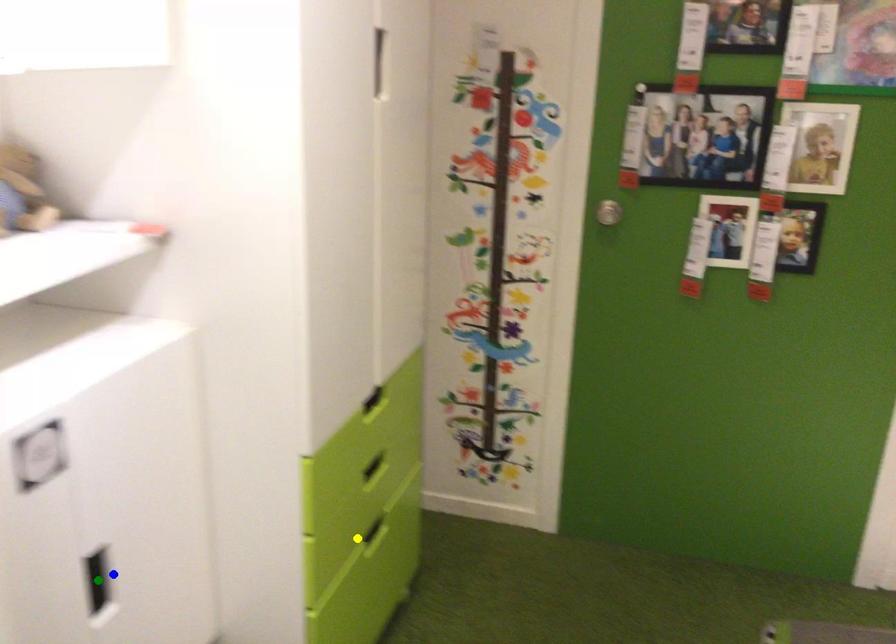
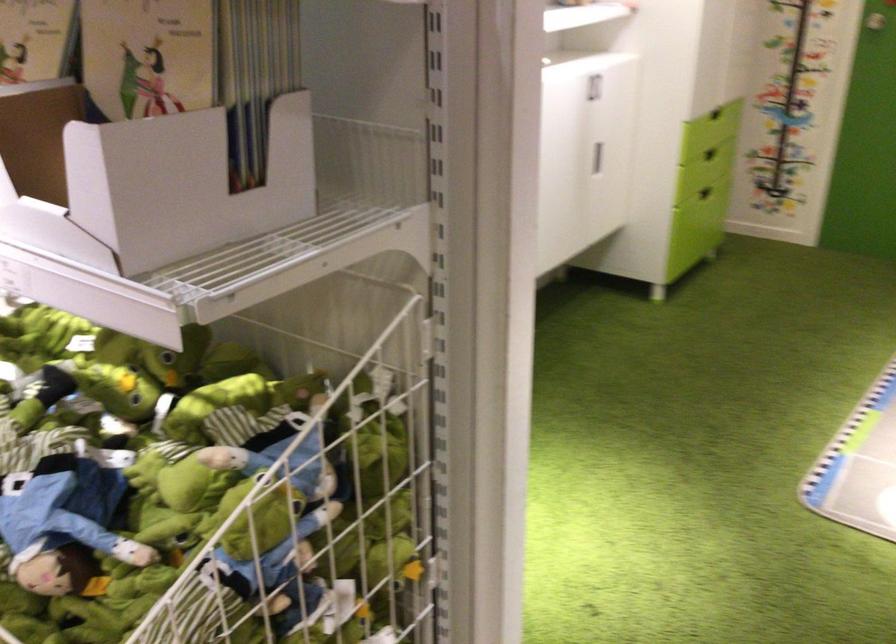
I am providing you with two images of the same scene from different viewpoints. Three points are marked in image1. Which point corresponds to a part or object that is occluded in image2?In image1, three points are marked. Which of them correspond to a part or object that is occluded in image2?Among the three points shown in image1, which one corresponds to a part or object that is no longer visible due to occlusion in image2?

green point cannot be seen in image2.